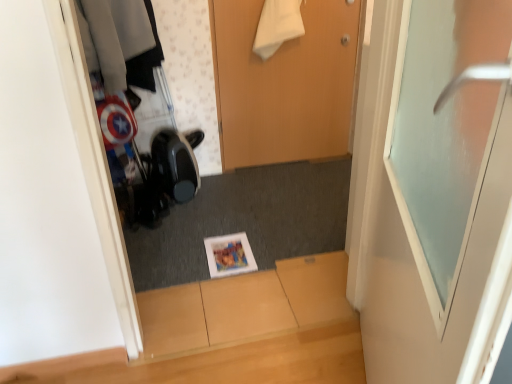
Question: Is wooden door at center, which is the first door in back-to-front order, to the left or to the right of frosted glass door at upper right, which appears as the 2th door when viewed from the back, in the image?

Choices:
 (A) left
 (B) right

Answer: (A)

Question: From the image's perspective, relative to frosted glass door at upper right, the first door when ordered from front to back, is wooden door at center, which is the first door in back-to-front order, above or below?

Choices:
 (A) below
 (B) above

Answer: (B)

Question: Considering the real-world distances, which object is closest to the frosted glass door at upper right, which appears as the 2th door when viewed from the back?

Choices:
 (A) wooden door at center, the second door when ordered from front to back
 (B) matte paper magazine at center

Answer: (B)

Question: Which is nearer to the frosted glass door at upper right, the first door when ordered from front to back?

Choices:
 (A) wooden door at center, the second door when ordered from front to back
 (B) matte paper magazine at center

Answer: (B)